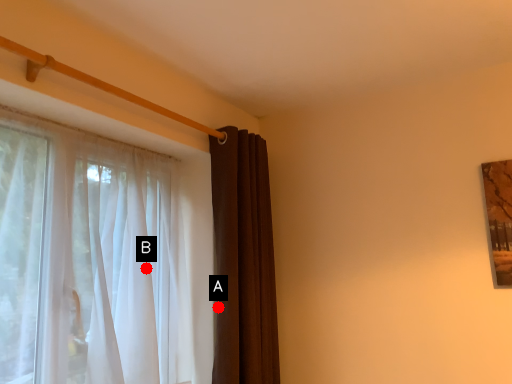
Question: Two points are circled on the image, labeled by A and B beside each circle. Which point appears closest to the camera in this image?

Choices:
 (A) A is closer
 (B) B is closer

Answer: (B)